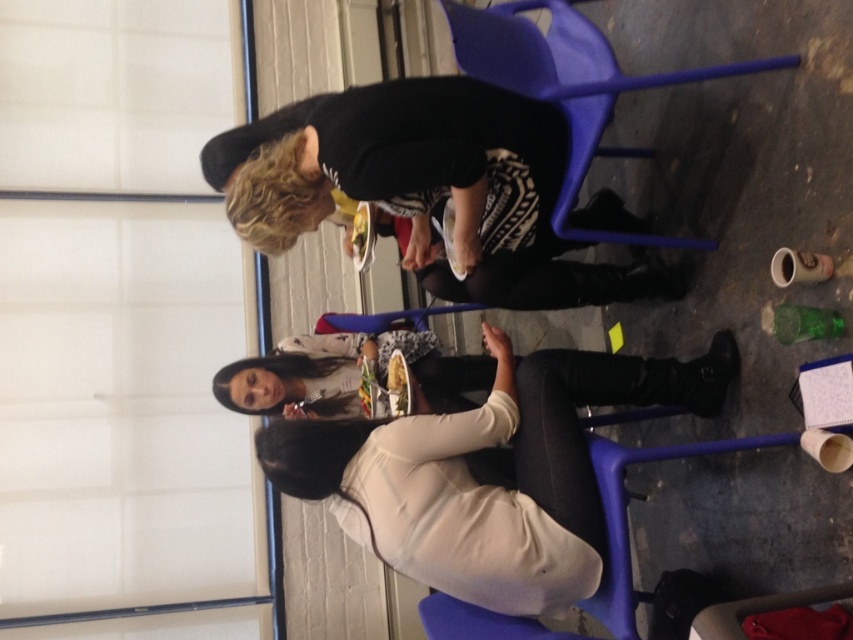
Question: Considering the relative positions of matte blue folding chair at center and black leather boots at lower center in the image provided, where is matte blue folding chair at center located with respect to black leather boots at lower center?

Choices:
 (A) below
 (B) above

Answer: (B)

Question: Which object is positioned closest to the matte blue folding chair at center?

Choices:
 (A) matte white sweater at center
 (B) black leather boots at lower center

Answer: (B)

Question: Observing the image, what is the correct spatial positioning of matte white sweater at center in reference to matte blue folding chair at center?

Choices:
 (A) right
 (B) left

Answer: (B)

Question: Which object is farther from the camera taking this photo?

Choices:
 (A) matte white sweater at center
 (B) matte blue folding chair at center

Answer: (B)

Question: Which object appears farthest from the camera in this image?

Choices:
 (A) matte white sweater at center
 (B) matte blue folding chair at center

Answer: (B)

Question: Is matte white sweater at center closer to the viewer compared to black leather boots at lower center?

Choices:
 (A) no
 (B) yes

Answer: (B)